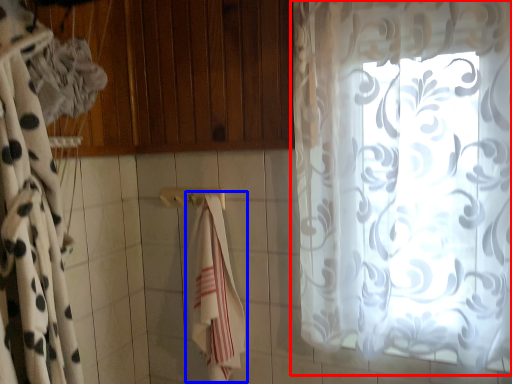
Question: Which point is closer to the camera, curtain (highlighted by a red box) or beach towel (highlighted by a blue box)?

Choices:
 (A) curtain
 (B) beach towel

Answer: (A)